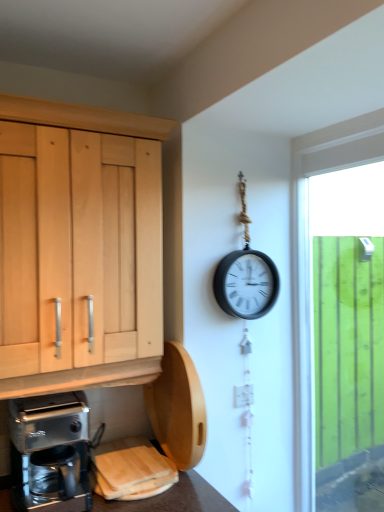
Question: From a real-world perspective, is metallic silver coffee maker at lower left beneath white glossy electric outlet at center-right?

Choices:
 (A) no
 (B) yes

Answer: (B)

Question: Would you say metallic silver coffee maker at lower left contains white glossy electric outlet at center-right?

Choices:
 (A) yes
 (B) no

Answer: (B)

Question: Is there a large distance between metallic silver coffee maker at lower left and white glossy electric outlet at center-right?

Choices:
 (A) yes
 (B) no

Answer: (B)

Question: Is metallic silver coffee maker at lower left next to white glossy electric outlet at center-right?

Choices:
 (A) yes
 (B) no

Answer: (B)

Question: Considering the relative sizes of metallic silver coffee maker at lower left and white glossy electric outlet at center-right in the image provided, is metallic silver coffee maker at lower left thinner than white glossy electric outlet at center-right?

Choices:
 (A) yes
 (B) no

Answer: (B)

Question: Is metallic silver coffee maker at lower left further to the viewer compared to white glossy electric outlet at center-right?

Choices:
 (A) no
 (B) yes

Answer: (A)

Question: Could you tell me if green wooden fence at right is turned towards metallic silver coffee maker at lower left?

Choices:
 (A) yes
 (B) no

Answer: (A)

Question: From the image's perspective, is green wooden fence at right under metallic silver coffee maker at lower left?

Choices:
 (A) yes
 (B) no

Answer: (B)

Question: Can you confirm if green wooden fence at right is wider than metallic silver coffee maker at lower left?

Choices:
 (A) yes
 (B) no

Answer: (B)

Question: Is green wooden fence at right surrounding metallic silver coffee maker at lower left?

Choices:
 (A) yes
 (B) no

Answer: (B)

Question: From the image's perspective, is green wooden fence at right on metallic silver coffee maker at lower left?

Choices:
 (A) yes
 (B) no

Answer: (A)

Question: Is green wooden fence at right far away from metallic silver coffee maker at lower left?

Choices:
 (A) yes
 (B) no

Answer: (A)

Question: From a real-world perspective, is metallic silver coffee maker at lower left beneath green wooden fence at right?

Choices:
 (A) yes
 (B) no

Answer: (A)